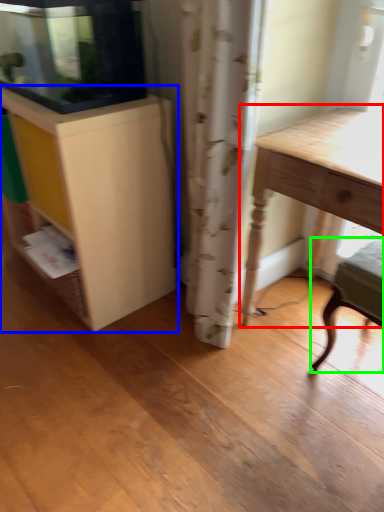
Question: Which is nearer to the table (highlighted by a red box)? cabinetry (highlighted by a blue box) or chair (highlighted by a green box).

Choices:
 (A) cabinetry
 (B) chair

Answer: (B)